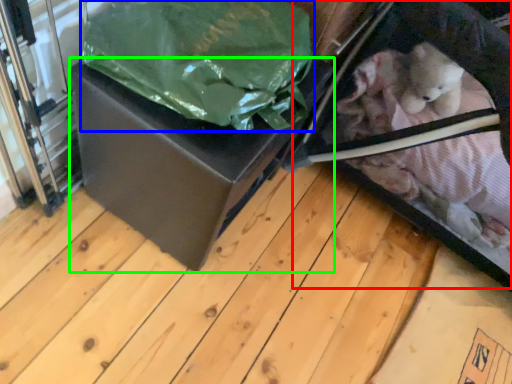
Question: Based on their relative distances, which object is farther from baby carriage (highlighted by a red box)? Choose from plastic bag (highlighted by a blue box) and box (highlighted by a green box).

Choices:
 (A) plastic bag
 (B) box

Answer: (A)